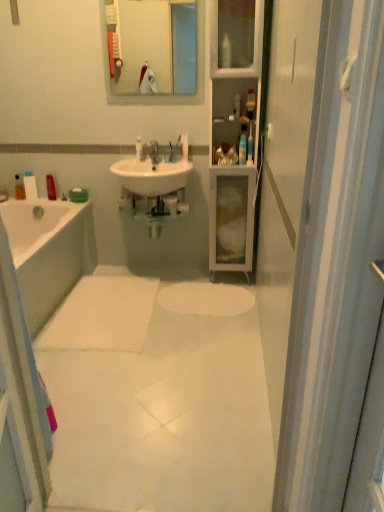
Image resolution: width=384 pixels, height=512 pixels. In order to click on free space to the back side of white fabric shower curtain at left in this screenshot , I will do [73, 410].